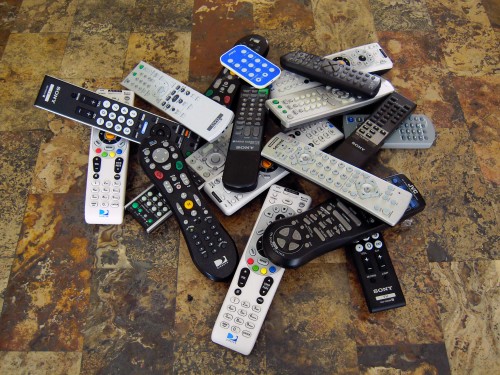
Where is `direct t.v remote`? direct t.v remote is located at coordinates (223, 257), (100, 214), (238, 341).